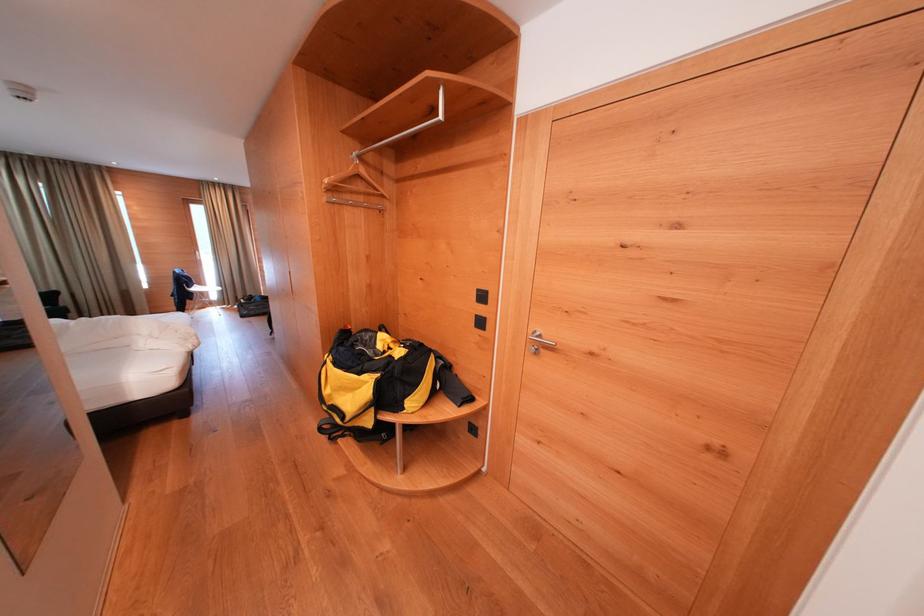
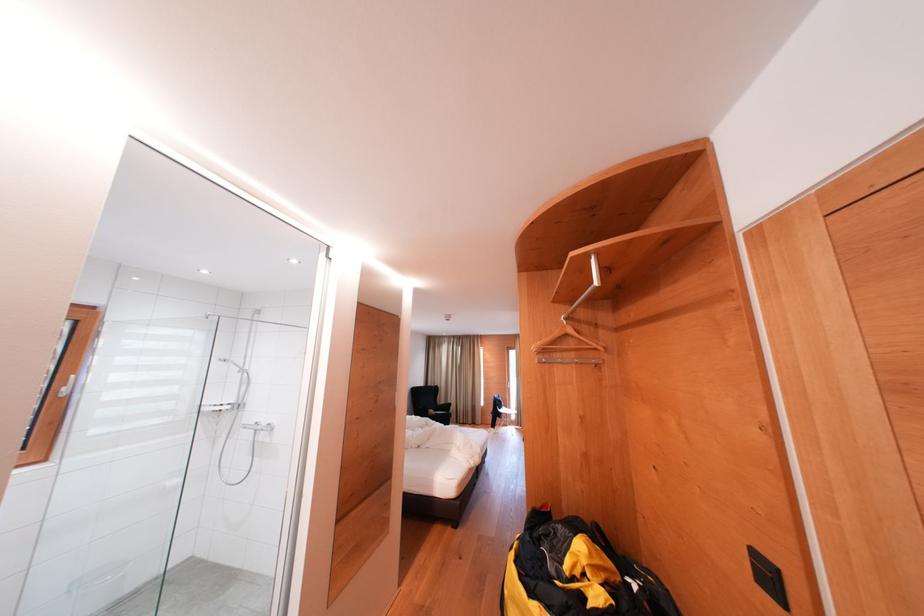
In the second image, find the point that corresponds to pixel 369 203 in the first image.

(579, 359)